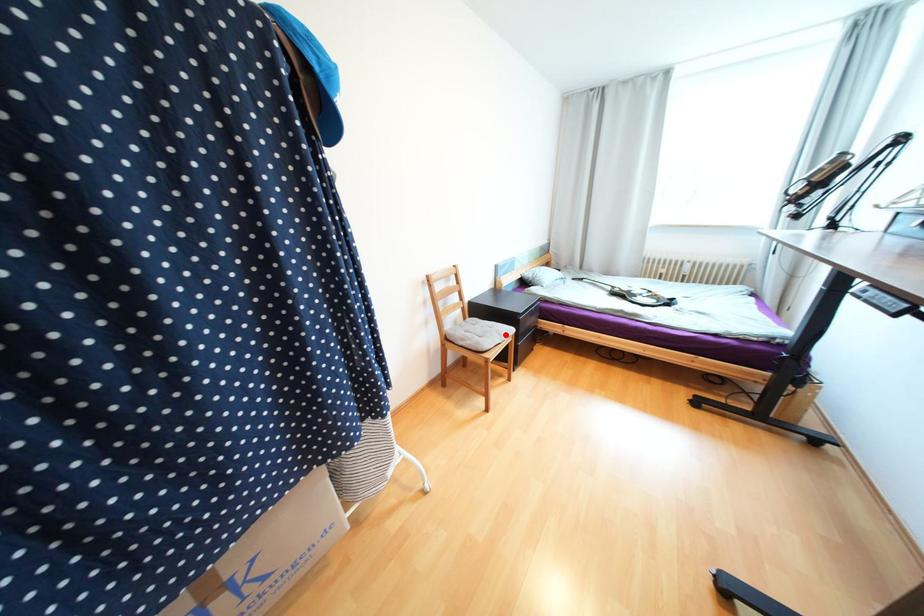
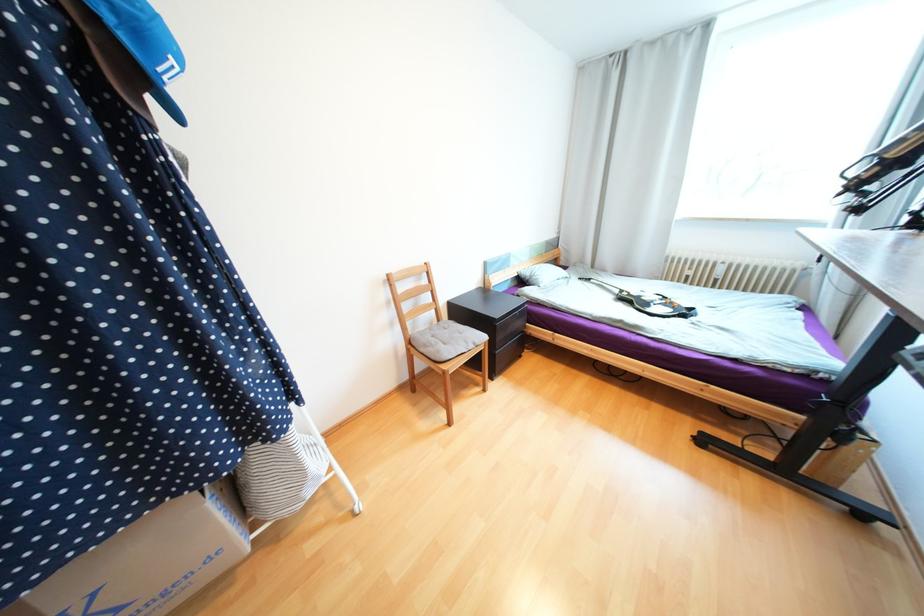
Question: I am providing you with two images of the same scene from different viewpoints. Given a red point in image1, look at the same physical point in image2. Is it:

Choices:
 (A) Closer to the viewpoint
 (B) Farther from the viewpoint

Answer: (A)